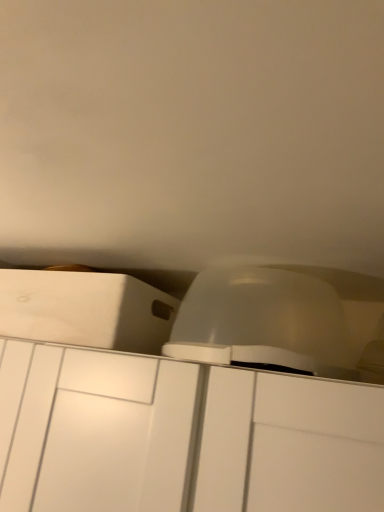
Question: Is white matte cabinet at upper left, the 1th cabinetry when ordered from top to bottom, smaller than transparent plastic dome at center?

Choices:
 (A) yes
 (B) no

Answer: (B)

Question: Is white matte cabinet at upper left, acting as the 2th cabinetry starting from the bottom, aimed at transparent plastic dome at center?

Choices:
 (A) no
 (B) yes

Answer: (A)

Question: Does white matte cabinet at upper left, acting as the 2th cabinetry starting from the bottom, contain transparent plastic dome at center?

Choices:
 (A) no
 (B) yes

Answer: (A)

Question: Can you confirm if white matte cabinet at upper left, acting as the 2th cabinetry starting from the bottom, is shorter than transparent plastic dome at center?

Choices:
 (A) yes
 (B) no

Answer: (A)

Question: From a real-world perspective, is white matte cabinet at upper left, acting as the 2th cabinetry starting from the bottom, under transparent plastic dome at center?

Choices:
 (A) yes
 (B) no

Answer: (A)

Question: Is white matte cabinet at upper left, the 1th cabinetry when ordered from top to bottom, closer to camera compared to transparent plastic dome at center?

Choices:
 (A) no
 (B) yes

Answer: (A)

Question: Is transparent plastic dome at center next to white matte cabinet at center, which appears as the 1th cabinetry when ordered from the bottom, and touching it?

Choices:
 (A) yes
 (B) no

Answer: (B)

Question: Is transparent plastic dome at center closer to camera compared to white matte cabinet at center, which appears as the 1th cabinetry when ordered from the bottom?

Choices:
 (A) yes
 (B) no

Answer: (B)

Question: From the image's perspective, is transparent plastic dome at center under white matte cabinet at center, which appears as the 1th cabinetry when ordered from the bottom?

Choices:
 (A) yes
 (B) no

Answer: (B)

Question: Is white matte cabinet at center, which appears as the 1th cabinetry when ordered from the bottom, inside transparent plastic dome at center?

Choices:
 (A) no
 (B) yes

Answer: (A)

Question: Considering the relative sizes of transparent plastic dome at center and white matte cabinet at center, the second cabinetry when ordered from top to bottom, in the image provided, is transparent plastic dome at center bigger than white matte cabinet at center, the second cabinetry when ordered from top to bottom,?

Choices:
 (A) yes
 (B) no

Answer: (B)

Question: Can you confirm if transparent plastic dome at center is thinner than white matte cabinet at center, which appears as the 1th cabinetry when ordered from the bottom?

Choices:
 (A) no
 (B) yes

Answer: (B)

Question: Can you confirm if white matte cabinet at center, the second cabinetry when ordered from top to bottom, is smaller than transparent plastic dome at center?

Choices:
 (A) yes
 (B) no

Answer: (B)